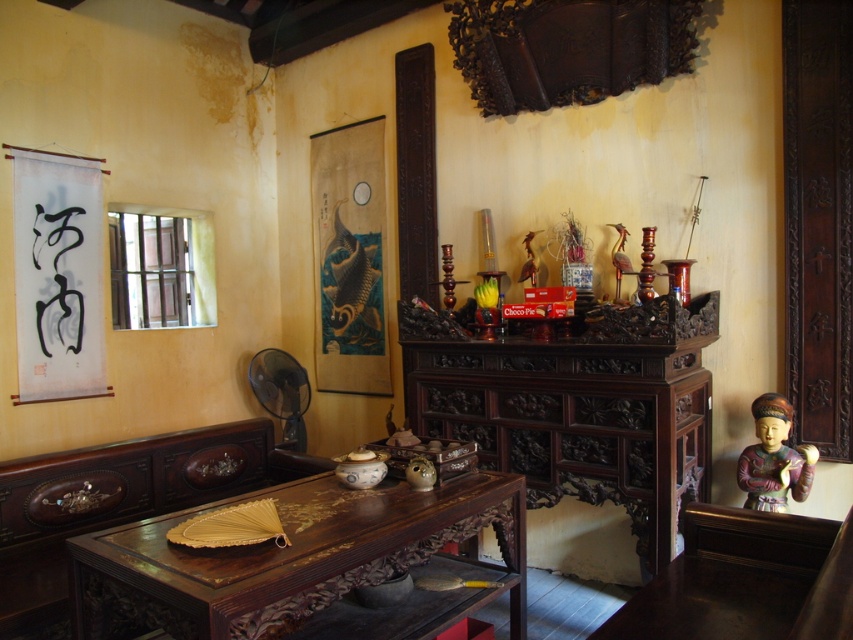
You are a delivery person who needs to place a package on the wooden polished table at center. The package is 3 feet wide. Can you walk around the wooden statue at right to reach the table without moving the statue?

The distance between the wooden polished table at center and wooden statue at right is 4.36 feet, which is more than enough for you to walk around the statue and reach the table without moving it.